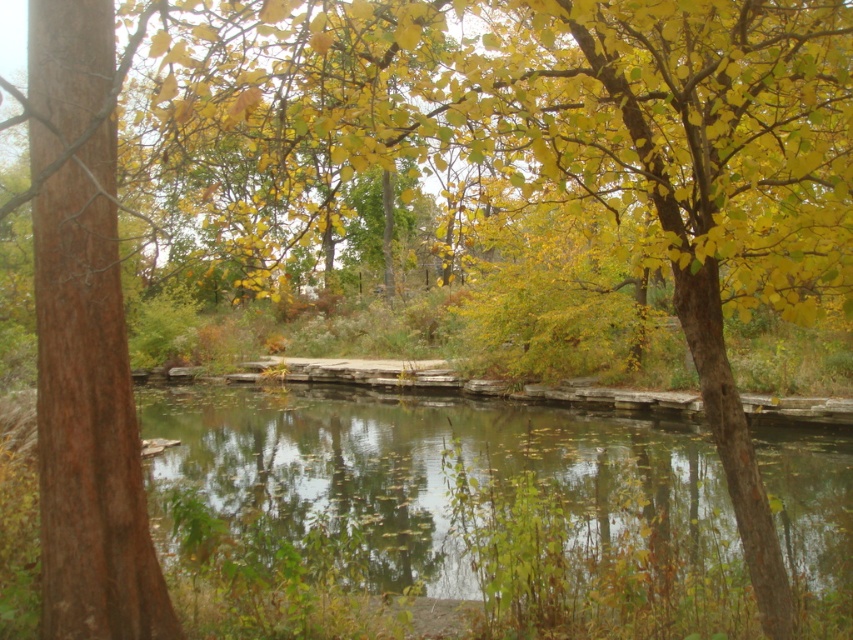
Between clear water at center and brown rough bark tree at left, which one has more height?

Standing taller between the two is brown rough bark tree at left.

Is clear water at center wider than brown rough bark tree at left?

Indeed, clear water at center has a greater width compared to brown rough bark tree at left.

Is point (480, 435) more distant than point (123, 550)?

Yes, point (480, 435) is farther from viewer.

Locate an element on the screen. Image resolution: width=853 pixels, height=640 pixels. clear water at center is located at coordinates (434, 470).